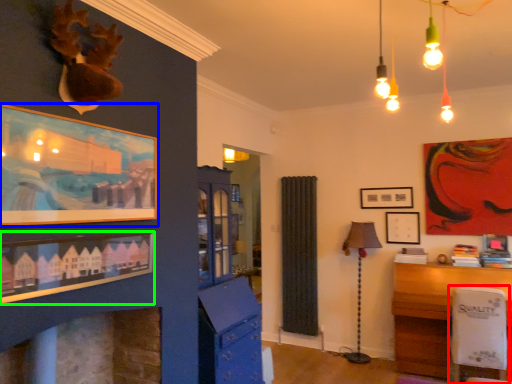
Question: Estimate the real-world distances between objects in this image. Which object is closer to swivel chair (highlighted by a red box), picture frame (highlighted by a blue box) or picture frame (highlighted by a green box)?

Choices:
 (A) picture frame
 (B) picture frame

Answer: (B)